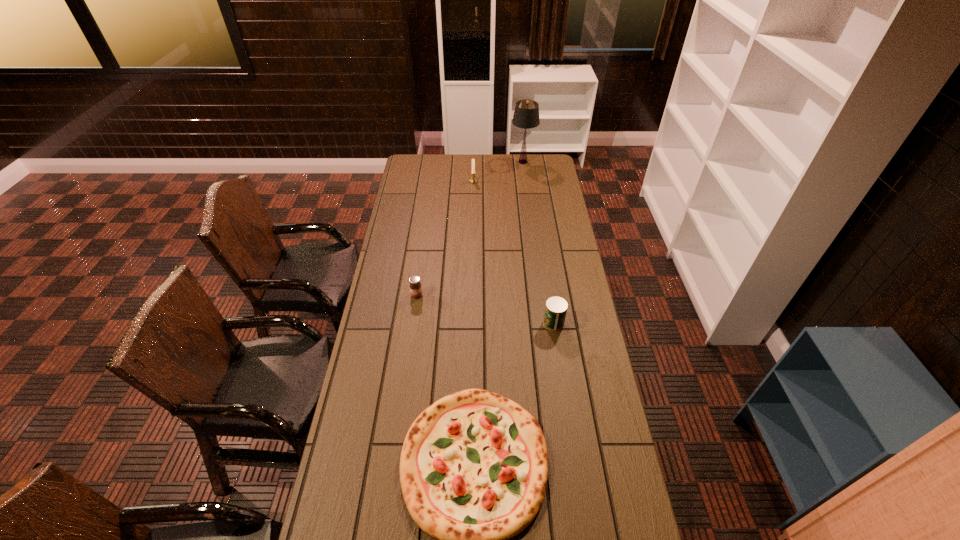
Identify the location of the second closest object to the fourth shortest object. (415, 286).

Find the location of `blank area in the image that satisfies the following two spatial constraints: 1. on the front-facing side of the lampshade; 2. on the front side of the second farthest object`. blank area in the image that satisfies the following two spatial constraints: 1. on the front-facing side of the lampshade; 2. on the front side of the second farthest object is located at coordinates (525, 181).

The height and width of the screenshot is (540, 960). Find the location of `free space that satisfies the following two spatial constraints: 1. on the front-facing side of the farthest object; 2. on the left side of the second nearest object`. free space that satisfies the following two spatial constraints: 1. on the front-facing side of the farthest object; 2. on the left side of the second nearest object is located at coordinates (544, 323).